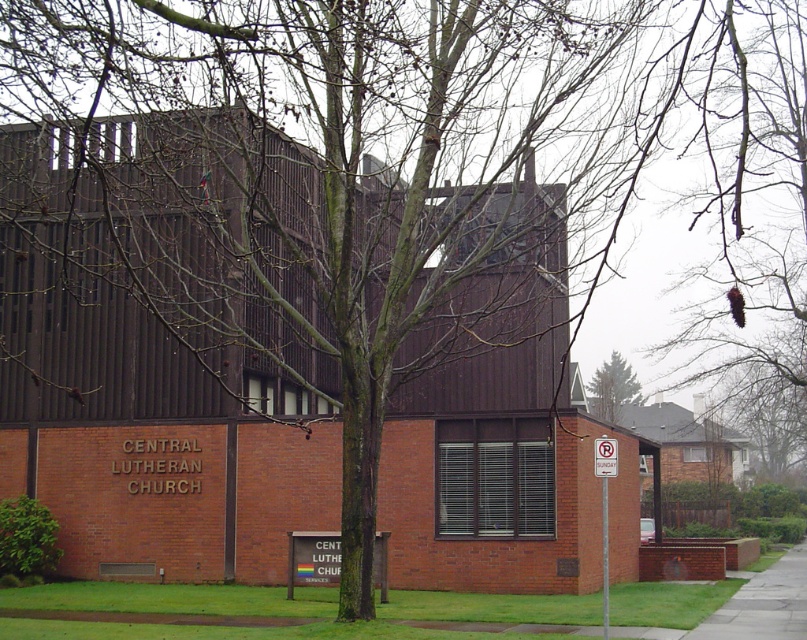
You are standing on the gray concrete sidewalk at lower right and want to walk towards the green coniferous tree at upper center. Which direction should you move to reach it?

To reach the green coniferous tree at upper center from the gray concrete sidewalk at lower right, you should move to the left since the sidewalk is positioned to the left of the tree.